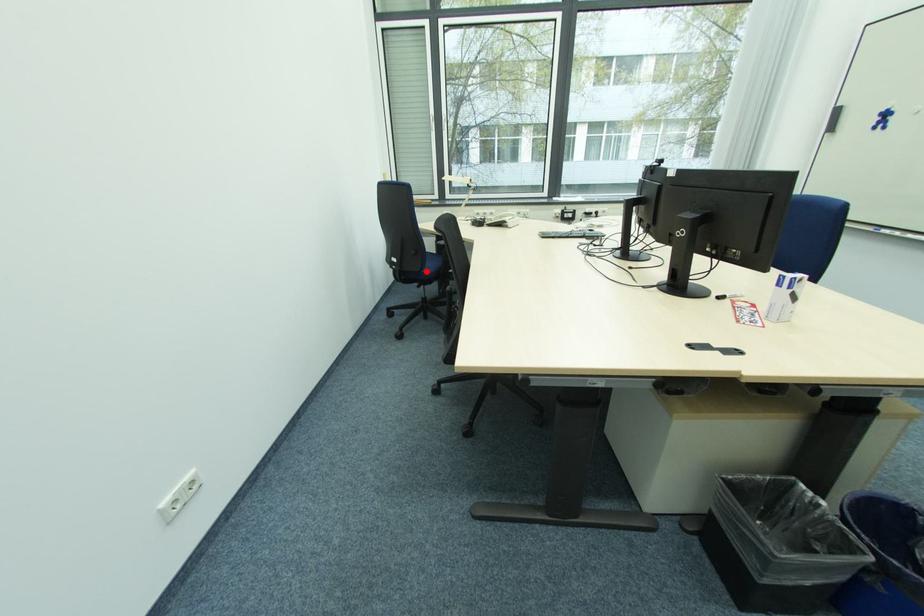
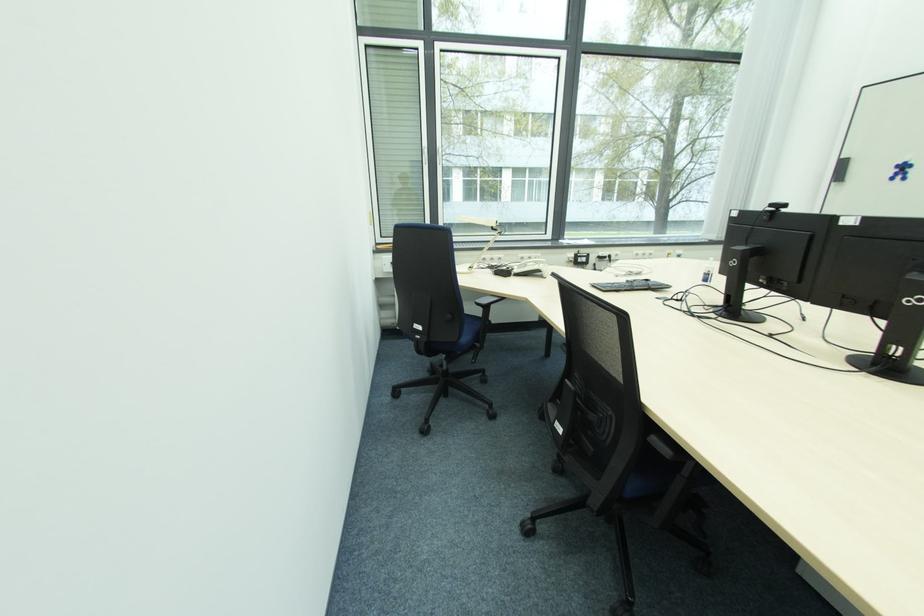
Question: I am providing you with two images of the same scene from different viewpoints. Image1 has a red point marked. In image2, the corresponding 3D location appears at what relative position? Reply with the corresponding letter.

Choices:
 (A) Closer
 (B) Farther

Answer: (B)